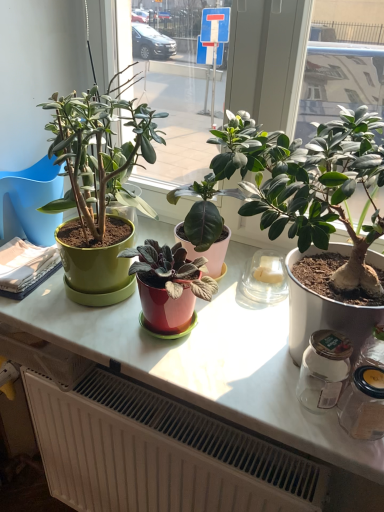
Where is `free spot above white matte radiator at lower center (from a real-world perspective)`? free spot above white matte radiator at lower center (from a real-world perspective) is located at coordinates (179, 421).